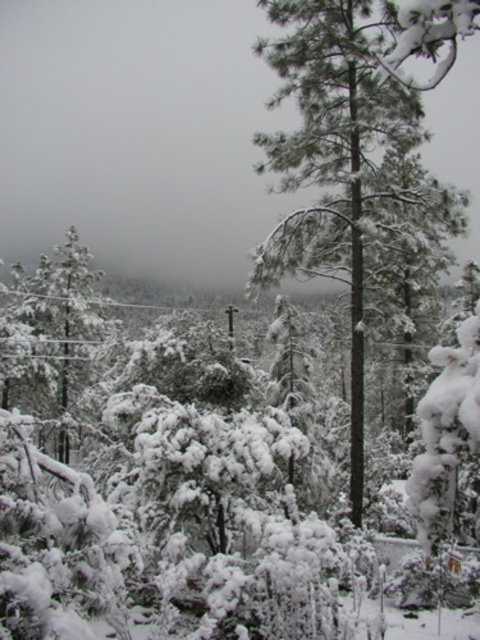
Is green textured pine tree at center to the left of snow-covered evergreen tree at left from the viewer's perspective?

No, green textured pine tree at center is not to the left of snow-covered evergreen tree at left.

Can you confirm if green textured pine tree at center is positioned to the right of snow-covered evergreen tree at left?

Indeed, green textured pine tree at center is positioned on the right side of snow-covered evergreen tree at left.

Measure the distance between point (302, 172) and camera.

The distance of point (302, 172) from camera is 17.07 meters.

Identify the location of green textured pine tree at center. This screenshot has height=640, width=480. (349, 128).